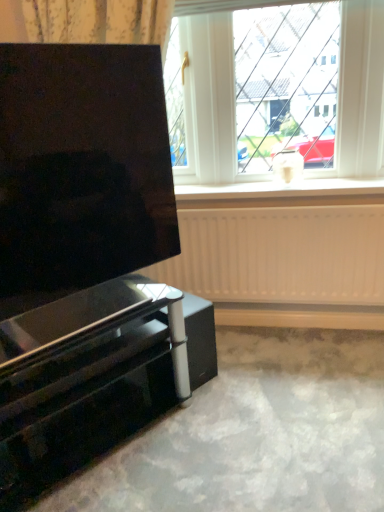
Image resolution: width=384 pixels, height=512 pixels. I want to click on empty space that is ontop of white matte window sill at center (from a real-world perspective), so click(278, 185).